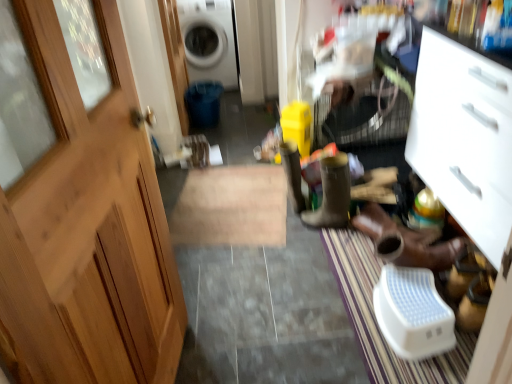
Question: Is brown leather boot at center, arranged as the 1th footwear when viewed from the left, far from brown leather shoes at lower right, the 1th footwear in the right-to-left sequence?

Choices:
 (A) no
 (B) yes

Answer: (A)

Question: From the image's perspective, would you say brown leather boot at center, arranged as the 1th footwear when viewed from the left, is shown under brown leather shoes at lower right, the 2th footwear viewed from the left?

Choices:
 (A) no
 (B) yes

Answer: (A)

Question: Could you tell me if brown leather boot at center, which is counted as the second footwear, starting from the right, is turned towards brown leather shoes at lower right, the 2th footwear viewed from the left?

Choices:
 (A) yes
 (B) no

Answer: (B)

Question: Does brown leather boot at center, arranged as the 1th footwear when viewed from the left, have a greater height compared to brown leather shoes at lower right, the 1th footwear in the right-to-left sequence?

Choices:
 (A) no
 (B) yes

Answer: (B)

Question: Is brown leather boot at center, arranged as the 1th footwear when viewed from the left, with brown leather shoes at lower right, the 1th footwear in the right-to-left sequence?

Choices:
 (A) yes
 (B) no

Answer: (B)

Question: Looking at their shapes, would you say white glossy washing machine at upper center is wider or thinner than brown leather boot at center, which is counted as the second footwear, starting from the right?

Choices:
 (A) wide
 (B) thin

Answer: (A)

Question: Is white glossy washing machine at upper center to the left or to the right of brown leather boot at center, which is counted as the second footwear, starting from the right, in the image?

Choices:
 (A) right
 (B) left

Answer: (B)

Question: Considering their positions, is white glossy washing machine at upper center located in front of or behind brown leather boot at center, arranged as the 1th footwear when viewed from the left?

Choices:
 (A) behind
 (B) front

Answer: (A)

Question: Considering the positions of white glossy washing machine at upper center and brown leather boot at center, which is counted as the second footwear, starting from the right, in the image, is white glossy washing machine at upper center taller or shorter than brown leather boot at center, which is counted as the second footwear, starting from the right,?

Choices:
 (A) tall
 (B) short

Answer: (A)

Question: Does point (360, 259) appear closer or farther from the camera than point (331, 200)?

Choices:
 (A) closer
 (B) farther

Answer: (A)

Question: From the image's perspective, is white textured doormat at lower right positioned above or below brown leather boot at center, which is counted as the second footwear, starting from the right?

Choices:
 (A) below
 (B) above

Answer: (A)

Question: Is white textured doormat at lower right taller or shorter than brown leather boot at center, arranged as the 1th footwear when viewed from the left?

Choices:
 (A) short
 (B) tall

Answer: (A)

Question: From a real-world perspective, relative to brown leather boot at center, which is counted as the second footwear, starting from the right, is white textured doormat at lower right vertically above or below?

Choices:
 (A) below
 (B) above

Answer: (A)

Question: Is wooden door at left in front of or behind yellow rubber boot at center in the image?

Choices:
 (A) behind
 (B) front

Answer: (B)

Question: In terms of height, does wooden door at left look taller or shorter compared to yellow rubber boot at center?

Choices:
 (A) short
 (B) tall

Answer: (B)